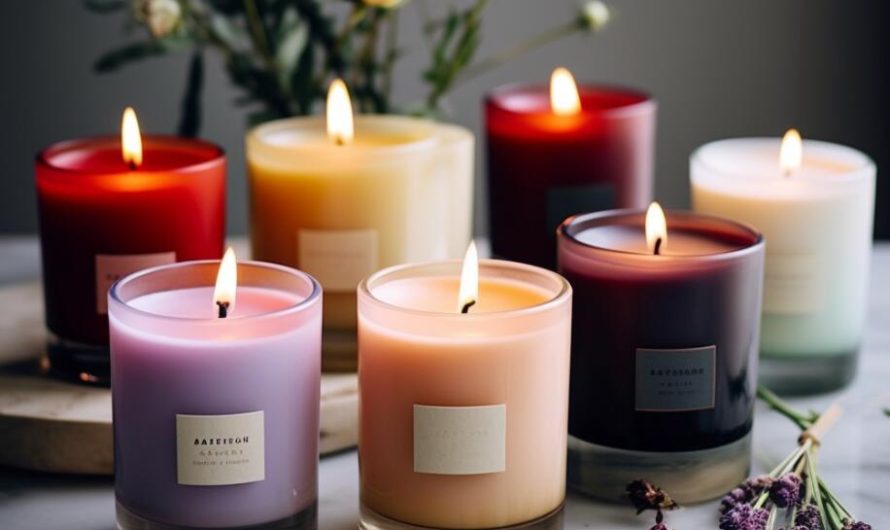
Image resolution: width=890 pixels, height=530 pixels. In order to click on candles in the back in this screenshot , I will do `click(164, 214)`, `click(352, 198)`, `click(555, 163)`, `click(804, 219)`.